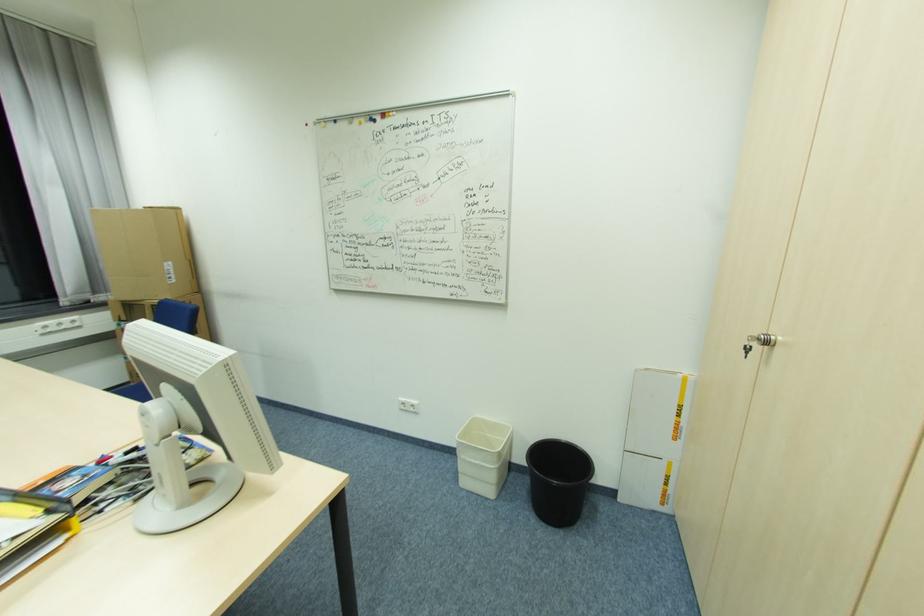
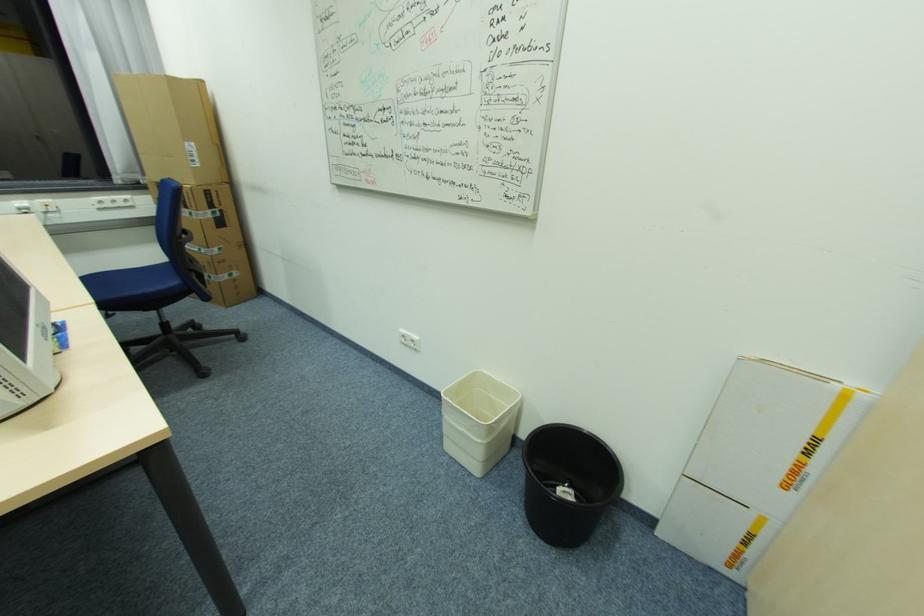
In the second image, find the point that corresponds to the point at 176,276 in the first image.

(200, 161)